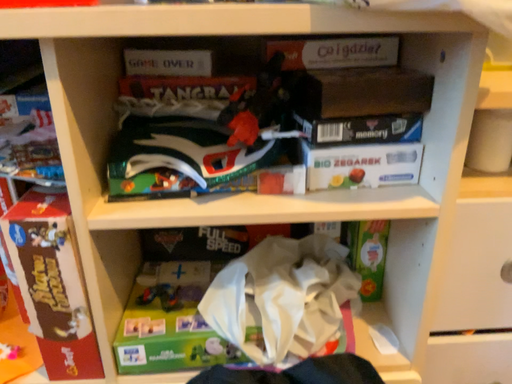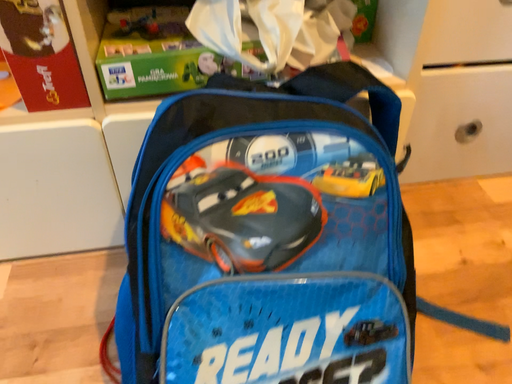
Question: How did the camera likely rotate when shooting the video?

Choices:
 (A) rotated left
 (B) rotated right

Answer: (B)